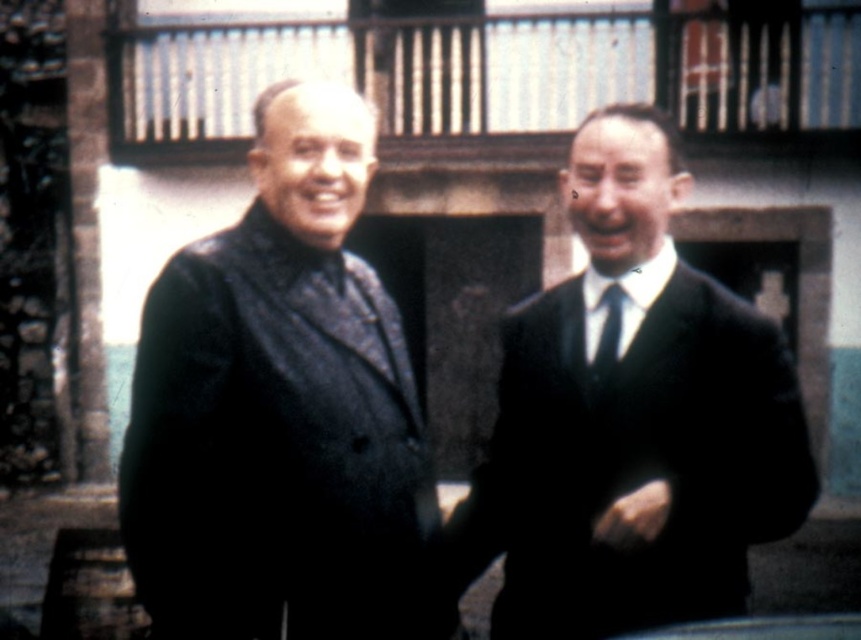
You are standing at the origin point in the image. The origin is at the bottom left corner of the image. You want to locate the matte black suit at right. In which direction should you look relative to the origin?

The matte black suit at right is located at coordinates 0.658 on the x axis and 0.735 on the y axis. Since the origin is at the bottom left corner, the x axis increases to the right and the y axis increases upward. Therefore, you should look to the upper right direction from the origin to locate the matte black suit at right.

You are a tailor measuring clothing items in a store. You have a matte black coat at left and a black silk tie at center. Which item requires more fabric to make?

The matte black coat at left requires more fabric because it has a larger size than the black silk tie at center.

You are a photographer standing at the doorway behind the two men. You want to take a photo of both the matte black coat at left and the man in the dark suit on the right in the same frame. Considering the distance between them, will you need to zoom in or zoom out to include both subjects in the photo?

The two men are 3.60 meters apart. To include both the matte black coat at left and the man in the dark suit on the right in the same frame, you would need to zoom out to capture the entire distance between them.